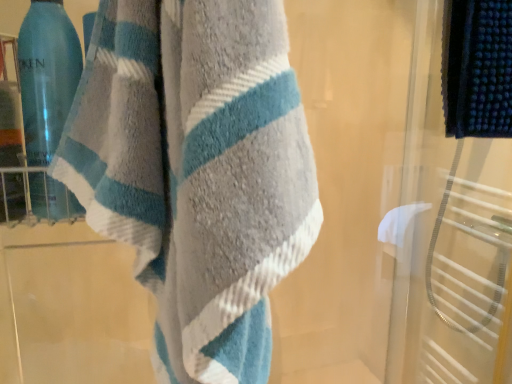
What do you see at coordinates (196, 171) in the screenshot? I see `soft cotton towel at center` at bounding box center [196, 171].

Locate an element on the screen. The image size is (512, 384). soft cotton towel at center is located at coordinates (196, 171).

At what (x,y) coordinates should I click in order to perform the action: click on soft cotton towel at center. Please return your answer as a coordinate pair (x, y). Looking at the image, I should click on (196, 171).